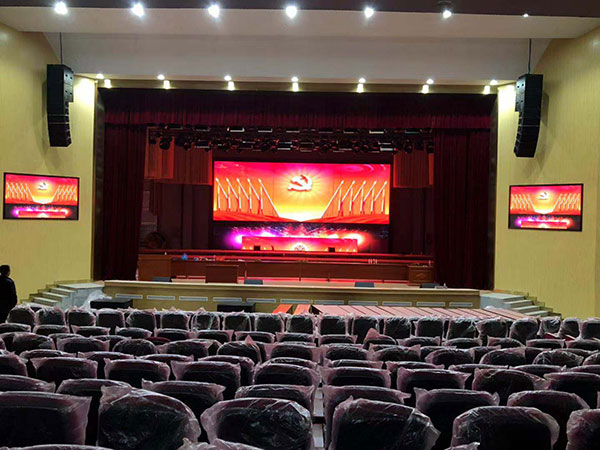
This screenshot has height=450, width=600. Find the location of `small screen`. small screen is located at coordinates (34, 201), (560, 214).